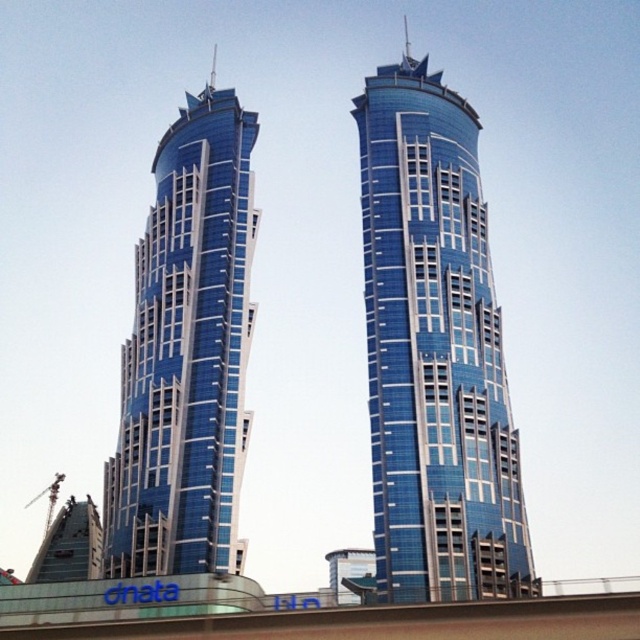
Question: Does glossy glass tower at center appear on the right side of blue glass building at center?

Choices:
 (A) yes
 (B) no

Answer: (A)

Question: In this image, where is glossy glass tower at center located relative to blue glass building at center?

Choices:
 (A) left
 (B) right

Answer: (B)

Question: Among these objects, which one is nearest to the camera?

Choices:
 (A) glossy glass tower at center
 (B) blue glass building at center

Answer: (A)

Question: Can you confirm if glossy glass tower at center is positioned above blue glass building at center?

Choices:
 (A) no
 (B) yes

Answer: (B)

Question: Among these points, which one is farthest from the camera?

Choices:
 (A) (152, 211)
 (B) (442, 506)

Answer: (A)

Question: Which point is closer to the camera?

Choices:
 (A) pyautogui.click(x=452, y=241)
 (B) pyautogui.click(x=170, y=374)

Answer: (B)